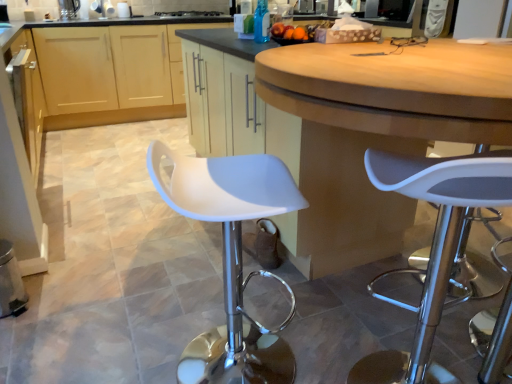
Question: From a real-world perspective, relative to white plastic stool at center, is white plastic stool at center vertically above or below?

Choices:
 (A) above
 (B) below

Answer: (A)

Question: Considering the positions of point (451, 241) and point (205, 380), is point (451, 241) closer or farther from the camera than point (205, 380)?

Choices:
 (A) farther
 (B) closer

Answer: (B)

Question: Considering the real-world distances, which object is farthest from the white plastic stool at center?

Choices:
 (A) black glass stove at upper center
 (B) matte wood cabinets at center, the 1th cabinetry from the back
 (C) blue glass bottle at upper center
 (D) matte white cabinet at center, marked as the second cabinetry in a back-to-front arrangement
 (E) white plastic stool at center

Answer: (A)

Question: Which object is the closest to the blue glass bottle at upper center?

Choices:
 (A) matte wood cabinets at center, the 1th cabinetry from the back
 (B) white plastic stool at center
 (C) white plastic stool at center
 (D) matte white cabinet at center, marked as the second cabinetry in a back-to-front arrangement
 (E) black glass stove at upper center

Answer: (D)